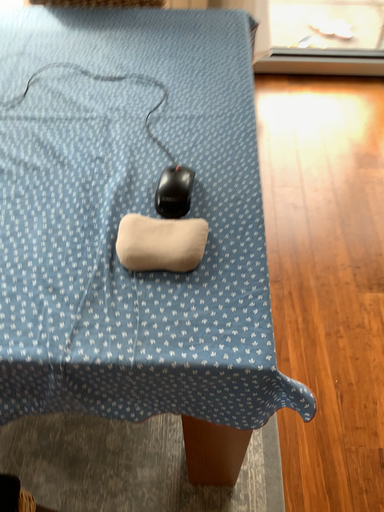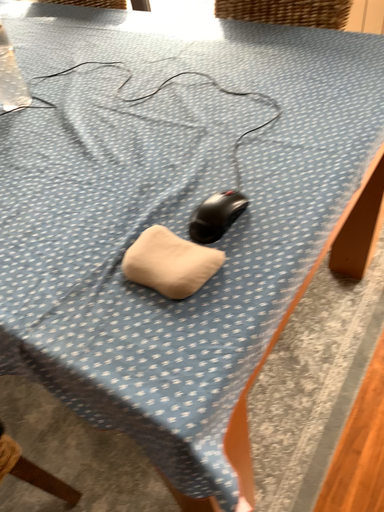
Question: Which way did the camera rotate in the video?

Choices:
 (A) rotated downward
 (B) rotated upward

Answer: (B)